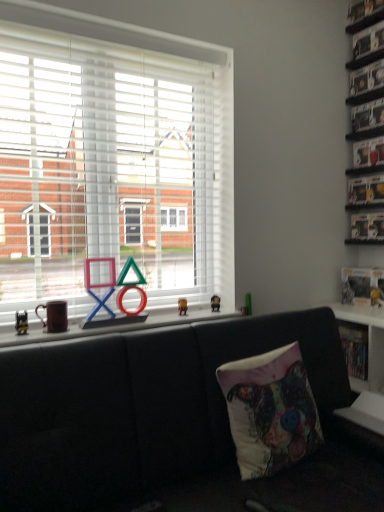
I want to click on metallic gold figurine at center, arranged as the first miniature when viewed from the back, so click(215, 303).

In order to face wooden shelf at right, the fourth shelf in the top-to-bottom sequence, should I rotate leftwards or rightwards?

Turn right approximately 21.384 degrees to face it.

The width and height of the screenshot is (384, 512). What do you see at coordinates (112, 160) in the screenshot?
I see `white plastic window at center` at bounding box center [112, 160].

At what (x,y) coordinates should I click in order to perform the action: click on metallic silver shelf at upper right, the 4th shelf positioned from the bottom. Please return your answer as a coordinate pair (x, y). This screenshot has height=512, width=384. Looking at the image, I should click on (367, 155).

Locate an element on the screen. clear plastic shelf at upper right, acting as the 5th shelf starting from the bottom is located at coordinates (367, 115).

Looking at their sizes, would you say metallic silver shelf at upper right, the 4th shelf positioned from the bottom, is wider or thinner than metallic gold figurine at center, the 2th miniature positioned from the right?

metallic silver shelf at upper right, the 4th shelf positioned from the bottom, is wider than metallic gold figurine at center, the 2th miniature positioned from the right.

Which object is positioned more to the left, metallic silver shelf at upper right, acting as the 2th shelf starting from the top, or metallic gold figurine at center, the 1th miniature positioned from the front?

metallic gold figurine at center, the 1th miniature positioned from the front.

Based on the photo, from the image's perspective, between metallic silver shelf at upper right, acting as the 2th shelf starting from the top, and metallic gold figurine at center, placed as the second miniature when sorted from back to front, who is located below?

metallic gold figurine at center, placed as the second miniature when sorted from back to front.

Based on the photo, can we say wooden shelf at right, arranged as the 2th shelf when ordered from the bottom, lies outside matte plastic game controller at center?

Yes, wooden shelf at right, arranged as the 2th shelf when ordered from the bottom, is outside of matte plastic game controller at center.

Is wooden shelf at right, arranged as the 2th shelf when ordered from the bottom, positioned far away from matte plastic game controller at center?

Indeed, wooden shelf at right, arranged as the 2th shelf when ordered from the bottom, is not near matte plastic game controller at center.

Looking at this image, from the image's perspective, which one is positioned lower, wooden shelf at right, the fourth shelf in the top-to-bottom sequence, or matte plastic game controller at center?

wooden shelf at right, the fourth shelf in the top-to-bottom sequence, appears lower in the image.

Is wooden shelf at right, arranged as the 2th shelf when ordered from the bottom, in front of or behind matte plastic game controller at center in the image?

wooden shelf at right, arranged as the 2th shelf when ordered from the bottom, is positioned farther from the viewer than matte plastic game controller at center.

Does white plastic shelf at lower right, which is the first shelf from bottom to top, have a larger size compared to wooden shelf at right, arranged as the 2th shelf when ordered from the bottom?

Correct, white plastic shelf at lower right, which is the first shelf from bottom to top, is larger in size than wooden shelf at right, arranged as the 2th shelf when ordered from the bottom.

In the image, there is a wooden shelf at right, arranged as the 2th shelf when ordered from the bottom. What are the coordinates of `shelf below it (from the image's perspective)` in the screenshot? It's located at (368, 341).

Is white plastic shelf at lower right, which is the first shelf from bottom to top, not inside wooden shelf at right, the fourth shelf in the top-to-bottom sequence?

Indeed, white plastic shelf at lower right, which is the first shelf from bottom to top, is completely outside wooden shelf at right, the fourth shelf in the top-to-bottom sequence.

How many degrees apart are the facing directions of white plastic shelf at lower right, which is counted as the 5th shelf, starting from the top, and wooden shelf at right, arranged as the 2th shelf when ordered from the bottom?

The angle between the facing direction of white plastic shelf at lower right, which is counted as the 5th shelf, starting from the top, and the facing direction of wooden shelf at right, arranged as the 2th shelf when ordered from the bottom, is 2.28 degrees.

Does metallic gold figurine at center, placed as the second miniature when sorted from back to front, have a greater width compared to matte plastic game controller at center?

No, metallic gold figurine at center, placed as the second miniature when sorted from back to front, is not wider than matte plastic game controller at center.

Is metallic gold figurine at center, positioned as the 1th miniature in left-to-right order, far away from matte plastic game controller at center?

No, there isn't a large distance between metallic gold figurine at center, positioned as the 1th miniature in left-to-right order, and matte plastic game controller at center.

Is metallic gold figurine at center, placed as the second miniature when sorted from back to front, spatially inside matte plastic game controller at center, or outside of it?

metallic gold figurine at center, placed as the second miniature when sorted from back to front, cannot be found inside matte plastic game controller at center.

Consider the image. Which of these two, metallic gold figurine at center, the second miniature in the left-to-right sequence, or clear plastic shelf at upper right, marked as the 1th shelf in a top-to-bottom arrangement, is bigger?

clear plastic shelf at upper right, marked as the 1th shelf in a top-to-bottom arrangement, is bigger.

Locate an element on the screen. the 1st miniature in front of the clear plastic shelf at upper right, marked as the 1th shelf in a top-to-bottom arrangement, counting from the anchor's position is located at coordinates (215, 303).

From the picture: From the image's perspective, between metallic gold figurine at center, the second miniature in the left-to-right sequence, and clear plastic shelf at upper right, acting as the 5th shelf starting from the bottom, which one is located above?

clear plastic shelf at upper right, acting as the 5th shelf starting from the bottom, from the image's perspective.

Does point (216, 302) come in front of point (368, 101)?

Yes, it is.

Are metallic gold figurine at center, arranged as the first miniature when viewed from the back, and matte plastic game controller at center far apart?

No, metallic gold figurine at center, arranged as the first miniature when viewed from the back, is in close proximity to matte plastic game controller at center.

Considering the sizes of objects metallic gold figurine at center, placed as the first miniature when sorted from right to left, and matte plastic game controller at center in the image provided, who is wider, metallic gold figurine at center, placed as the first miniature when sorted from right to left, or matte plastic game controller at center?

Wider between the two is matte plastic game controller at center.

Locate an element on the screen. This screenshot has height=512, width=384. toy that is above the metallic gold figurine at center, arranged as the first miniature when viewed from the back (from a real-world perspective) is located at coordinates (112, 294).

How much distance is there between metallic gold figurine at center, which ranks as the second miniature in front-to-back order, and matte plastic game controller at center?

metallic gold figurine at center, which ranks as the second miniature in front-to-back order, is 20.85 inches away from matte plastic game controller at center.

Who is smaller, matte plastic game controller at center or metallic gold figurine at center, the 2th miniature positioned from the right?

Smaller between the two is metallic gold figurine at center, the 2th miniature positioned from the right.

Is matte plastic game controller at center far from metallic gold figurine at center, the 1th miniature positioned from the front?

They are positioned close to each other.

Consider the image. Is matte plastic game controller at center not within metallic gold figurine at center, the 2th miniature positioned from the right?

Yes.

Does matte plastic game controller at center turn towards metallic gold figurine at center, the 2th miniature positioned from the right?

No, matte plastic game controller at center is not facing towards metallic gold figurine at center, the 2th miniature positioned from the right.

Find the location of a particular element. The width and height of the screenshot is (384, 512). miniature that is the 1st object directly below the metallic silver shelf at upper right, the 4th shelf positioned from the bottom (from a real-world perspective) is located at coordinates (182, 306).

Image resolution: width=384 pixels, height=512 pixels. Identify the location of toy above the wooden shelf at right, the fourth shelf in the top-to-bottom sequence (from a real-world perspective). (112, 294).

Consider the image. Estimate the real-world distances between objects in this image. Which object is closer to metallic silver shelf at upper right, the 3th shelf in the top-to-bottom sequence, matte plastic game controller at center or textured fabric pillow at center?

textured fabric pillow at center is closer to metallic silver shelf at upper right, the 3th shelf in the top-to-bottom sequence.

Looking at this image, when comparing their distances from metallic silver shelf at upper right, placed as the 3th shelf when sorted from bottom to top, does textured fabric pillow at center or metallic silver shelf at upper right, the 4th shelf positioned from the bottom, seem closer?

metallic silver shelf at upper right, the 4th shelf positioned from the bottom, is closer to metallic silver shelf at upper right, placed as the 3th shelf when sorted from bottom to top.

Looking at the image, which one is located closer to textured fabric pillow at center, metallic gold figurine at center, the second miniature in the left-to-right sequence, or black leather couch at lower center?

The object closer to textured fabric pillow at center is black leather couch at lower center.

Estimate the real-world distances between objects in this image. Which object is further from metallic gold figurine at center, the 2th miniature positioned from the right, white plastic shelf at lower right, which is counted as the 5th shelf, starting from the top, or matte plastic game controller at center?

Among the two, white plastic shelf at lower right, which is counted as the 5th shelf, starting from the top, is located further to metallic gold figurine at center, the 2th miniature positioned from the right.

Considering their positions, is black leather couch at lower center positioned further to metallic gold figurine at center, which ranks as the second miniature in front-to-back order, than metallic silver shelf at upper right, acting as the 2th shelf starting from the top?

metallic silver shelf at upper right, acting as the 2th shelf starting from the top, is positioned further to the anchor metallic gold figurine at center, which ranks as the second miniature in front-to-back order.

Based on the photo, considering their positions, is black leather couch at lower center positioned further to matte plastic game controller at center than metallic silver shelf at upper right, the 3th shelf in the top-to-bottom sequence?

metallic silver shelf at upper right, the 3th shelf in the top-to-bottom sequence, is positioned further to the anchor matte plastic game controller at center.

When comparing their distances from clear plastic shelf at upper right, marked as the 1th shelf in a top-to-bottom arrangement, does metallic silver shelf at upper right, the 3th shelf in the top-to-bottom sequence, or wooden shelf at right, the fourth shelf in the top-to-bottom sequence, seem closer?

metallic silver shelf at upper right, the 3th shelf in the top-to-bottom sequence.

Estimate the real-world distances between objects in this image. Which object is further from metallic gold figurine at center, the second miniature in the left-to-right sequence, metallic silver shelf at upper right, acting as the 2th shelf starting from the top, or wooden shelf at right, arranged as the 2th shelf when ordered from the bottom?

metallic silver shelf at upper right, acting as the 2th shelf starting from the top.

What are the coordinates of `pillow between clear plastic shelf at upper right, acting as the 5th shelf starting from the bottom, and white plastic shelf at lower right, which is counted as the 5th shelf, starting from the top, from top to bottom` in the screenshot? It's located at (270, 411).

Where is `shelf between textured fabric pillow at center and wooden shelf at right, arranged as the 2th shelf when ordered from the bottom, along the z-axis`? shelf between textured fabric pillow at center and wooden shelf at right, arranged as the 2th shelf when ordered from the bottom, along the z-axis is located at coordinates (368, 341).

Where is `toy that lies between white plastic window at center and textured fabric pillow at center from top to bottom`? The image size is (384, 512). toy that lies between white plastic window at center and textured fabric pillow at center from top to bottom is located at coordinates (112, 294).

Where is `window between matte plastic game controller at center and metallic silver shelf at upper right, acting as the 2th shelf starting from the top, in the horizontal direction`? The image size is (384, 512). window between matte plastic game controller at center and metallic silver shelf at upper right, acting as the 2th shelf starting from the top, in the horizontal direction is located at coordinates (112, 160).